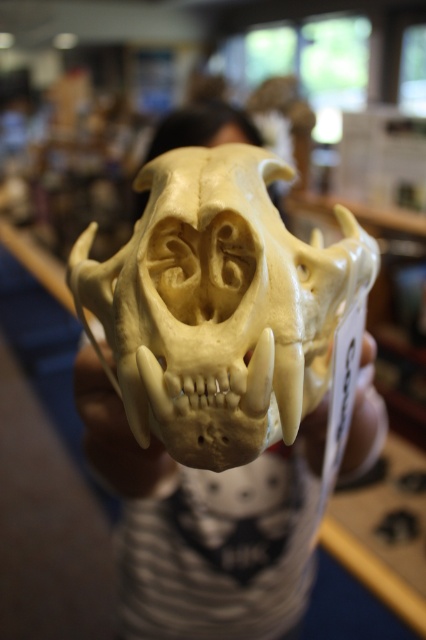
Between point (112, 468) and point (365, 385), which one is positioned behind?

Positioned behind is point (112, 468).

Is white bone hand at center thinner than white bone skull at center?

Indeed, white bone hand at center has a lesser width compared to white bone skull at center.

This screenshot has height=640, width=426. I want to click on white bone hand at center, so click(117, 436).

Is ivory bone skull at center thinner than white bone skull at center?

No.

Which is in front, point (120, 285) or point (373, 449)?

Point (120, 285)

Locate an element on the screen. The image size is (426, 640). ivory bone skull at center is located at coordinates (219, 305).

Who is positioned more to the left, ivory bone skull at center or white bone hand at center?

Positioned to the left is white bone hand at center.

You are a GUI agent. You are given a task and a screenshot of the screen. Output one action in this format:
    pyautogui.click(x=<x>, y=<y>)
    Task: Click on the ivory bone skull at center
    This screenshot has height=640, width=426.
    Given the screenshot: What is the action you would take?
    pyautogui.click(x=219, y=305)

Is point (264, 384) farther from viewer compared to point (94, 378)?

No, it is not.

This screenshot has height=640, width=426. What are the coordinates of `ivory bone skull at center` in the screenshot? It's located at (219, 305).